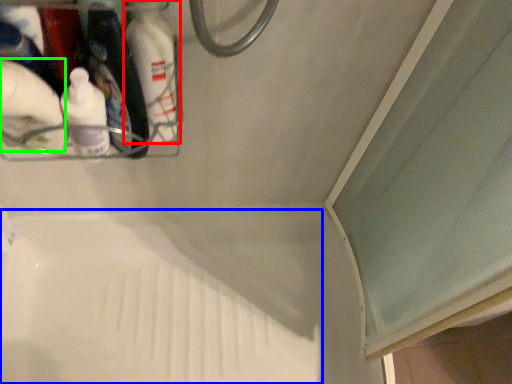
Question: Considering the real-world distances, which object is closest to bottle (highlighted by a red box)? bath (highlighted by a blue box) or cleaning product (highlighted by a green box).

Choices:
 (A) bath
 (B) cleaning product

Answer: (B)